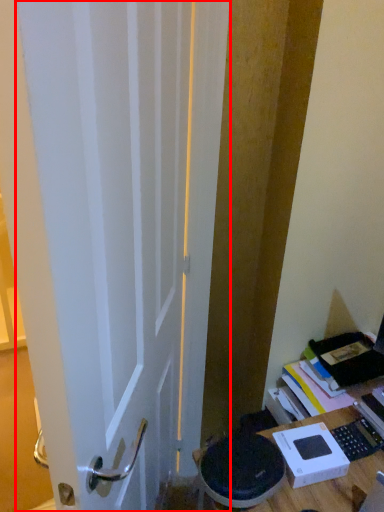
Question: Observing the image, what is the correct spatial positioning of door (annotated by the red box) in reference to cardboard box?

Choices:
 (A) left
 (B) right

Answer: (A)